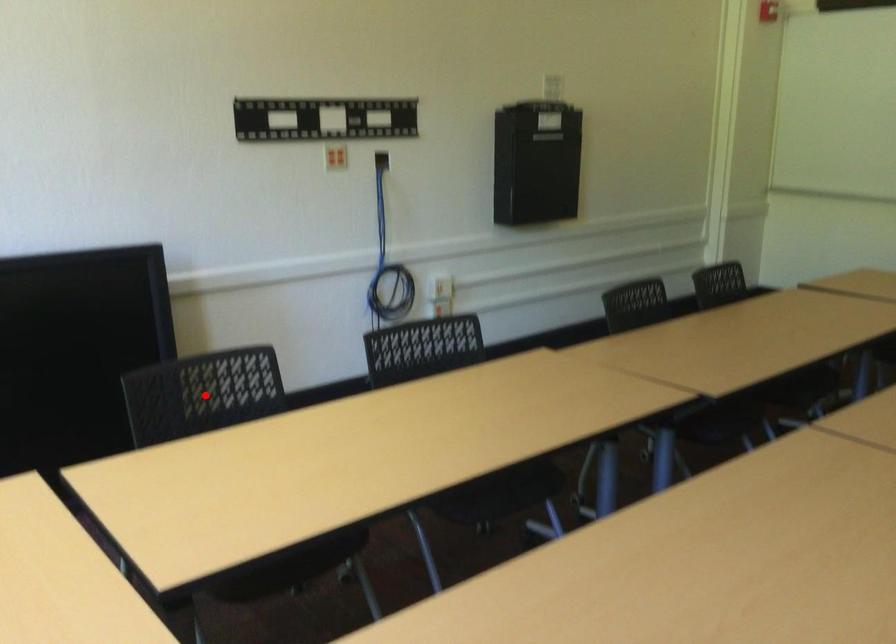
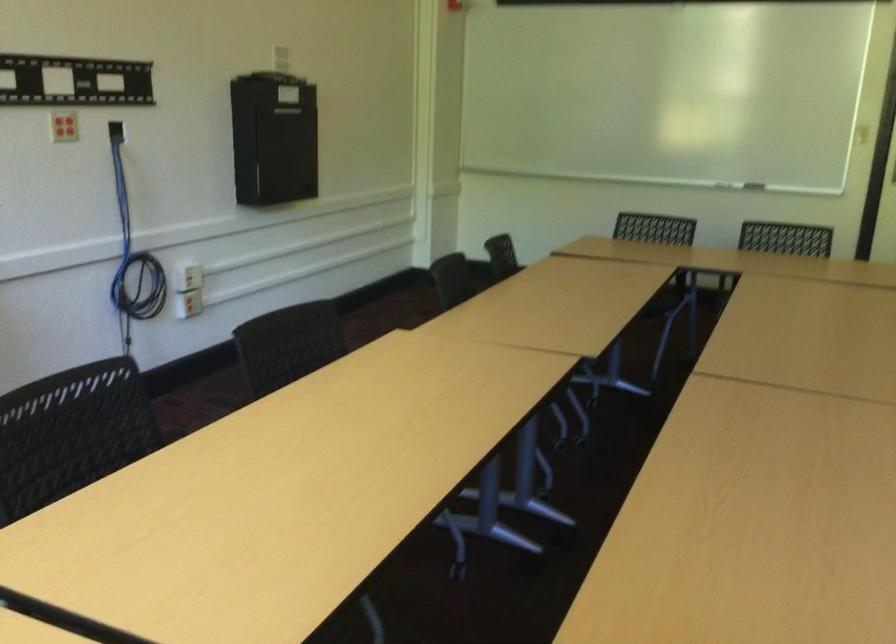
Where in the second image is the point corresponding to the highlighted location from the first image?

(71, 433)